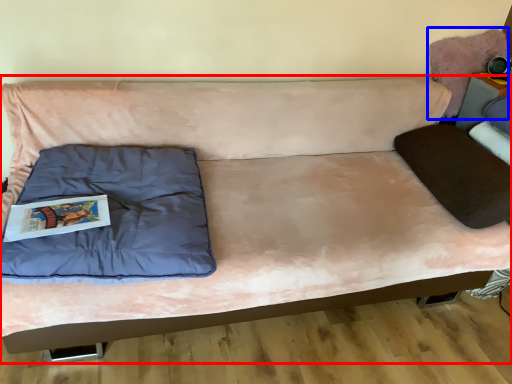
Question: Which object appears farthest to the camera in this image, studio couch (highlighted by a red box) or swivel chair (highlighted by a blue box)?

Choices:
 (A) studio couch
 (B) swivel chair

Answer: (B)